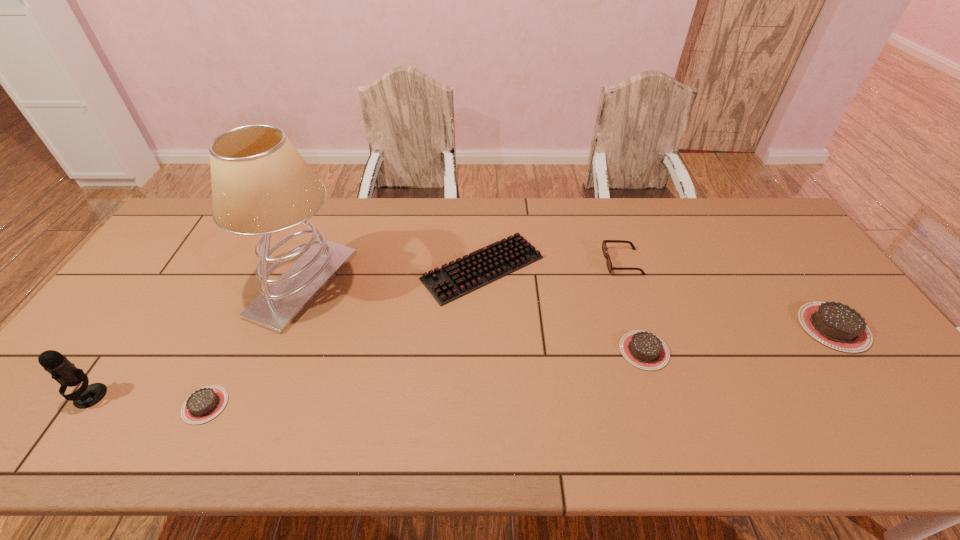
Locate an element on the screen. This screenshot has width=960, height=540. chocolate cake that stands as the closest to the fifth tallest object is located at coordinates (835, 325).

Where is `vacant space that satisfies the following two spatial constraints: 1. on the back side of the tallest object; 2. on the left side of the leftmost object`? The image size is (960, 540). vacant space that satisfies the following two spatial constraints: 1. on the back side of the tallest object; 2. on the left side of the leftmost object is located at coordinates (169, 284).

The height and width of the screenshot is (540, 960). I want to click on free point that satisfies the following two spatial constraints: 1. on the front-facing side of the sunglasses; 2. on the left side of the rightmost chocolate cake, so click(x=644, y=327).

This screenshot has height=540, width=960. I want to click on vacant space that satisfies the following two spatial constraints: 1. on the back side of the shortest chocolate cake; 2. on the right side of the rightmost chocolate cake, so click(x=243, y=327).